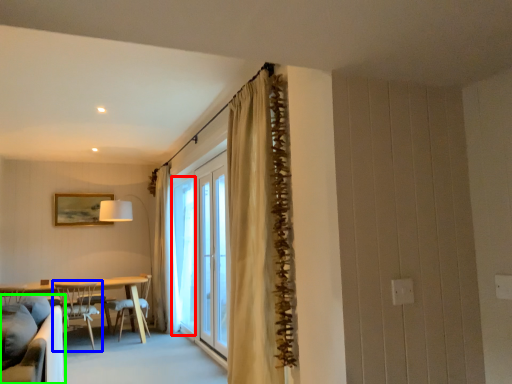
Question: Which is farther away from window (highlighted by a red box)? chair (highlighted by a blue box) or studio couch (highlighted by a green box)?

Choices:
 (A) chair
 (B) studio couch

Answer: (B)